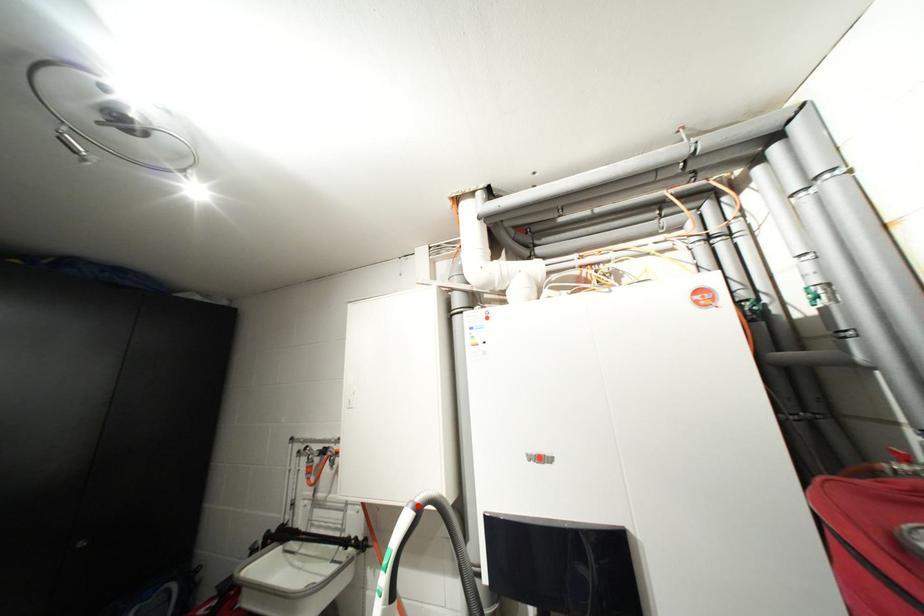
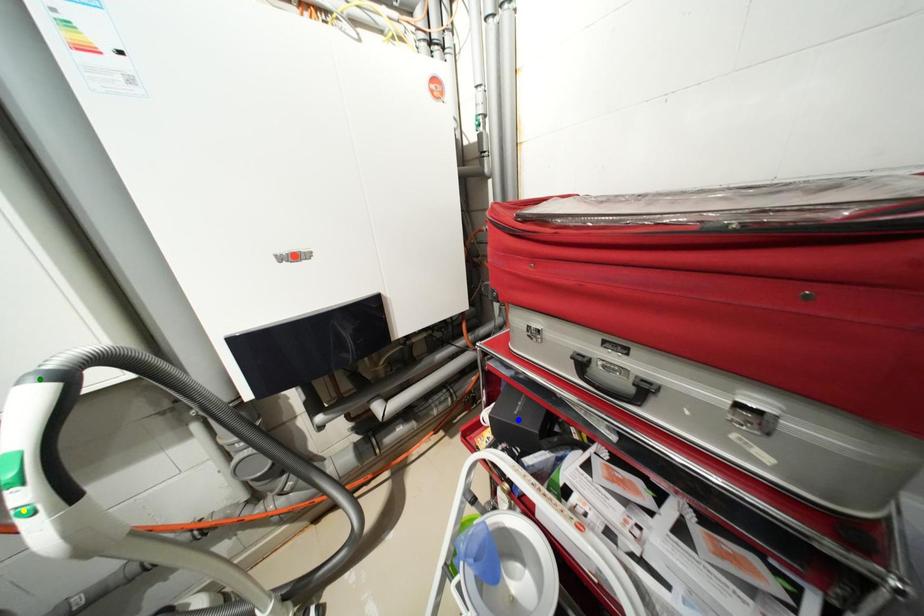
Question: I am providing you with two images of the same scene from different viewpoints. A red point is marked on the first image. You are given multiple points on the second image. Which point in image 2 is actually the same real-world point as the red point in image 1?

Choices:
 (A) blue point
 (B) green point
 (C) yellow point

Answer: (B)